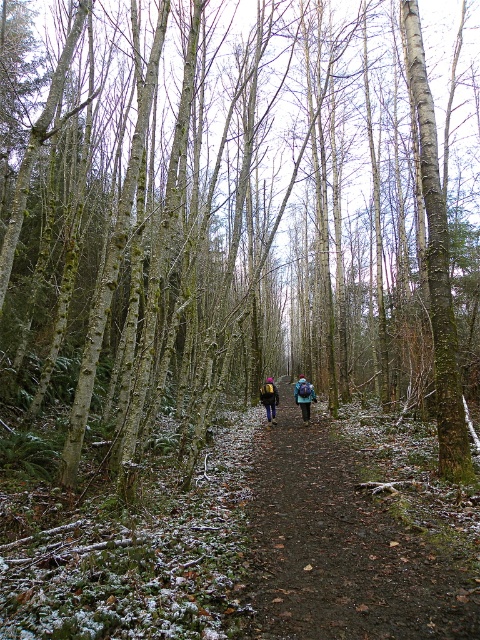
You are hiking along a forest path in the scene. You notice the brown dirt path at center and the blue fabric backpack at center. Which object is positioned higher relative to the other?

The brown dirt path at center is above the blue fabric backpack at center, so the brown dirt path at center is higher.

You are a hiker planning to walk along the forest path shown in the image. You notice two items of the same color at the center of the path. Which item is located to the right of the other? The blue fabric backpack at center or the blue fabric jacket at center?

The blue fabric backpack at center is positioned on the right side of the blue fabric jacket at center.